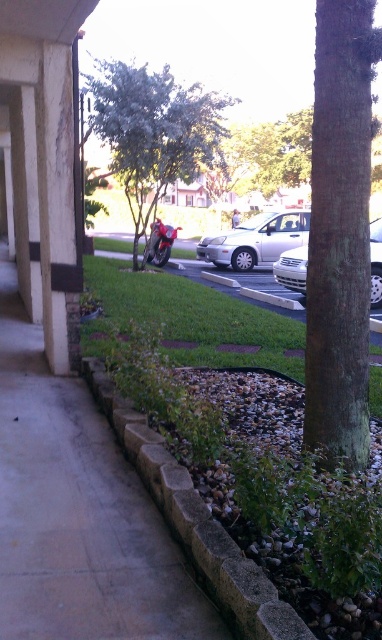
Question: Is green grass at center thinner than shiny red motorcycle at center?

Choices:
 (A) yes
 (B) no

Answer: (B)

Question: Among these objects, which one is farthest from the camera?

Choices:
 (A) brown concrete pavement at center
 (B) white matte car at center

Answer: (B)

Question: Does green grass at center have a smaller size compared to green leafy tree at center?

Choices:
 (A) no
 (B) yes

Answer: (B)

Question: Can you confirm if green leafy tree at center is positioned to the left of gray stone curb at lower center?

Choices:
 (A) no
 (B) yes

Answer: (B)

Question: Which point is closer to the camera?

Choices:
 (A) gray stone curb at lower center
 (B) white matte car at center
 (C) green rough bark tree at right

Answer: (A)

Question: Estimate the real-world distances between objects in this image. Which object is closer to the shiny red motorcycle at center?

Choices:
 (A) green rough bark tree at right
 (B) white matte car at center

Answer: (B)